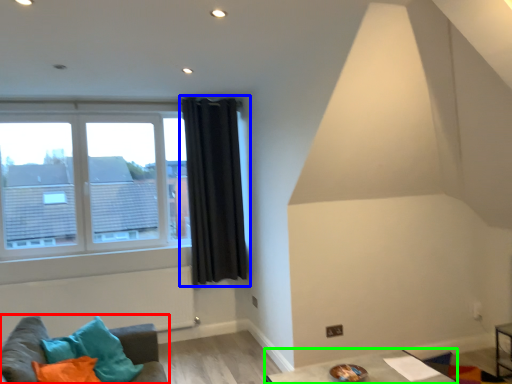
Question: Based on their relative distances, which object is nearer to studio couch (highlighted by a red box)? Choose from curtain (highlighted by a blue box) and table (highlighted by a green box).

Choices:
 (A) curtain
 (B) table

Answer: (B)